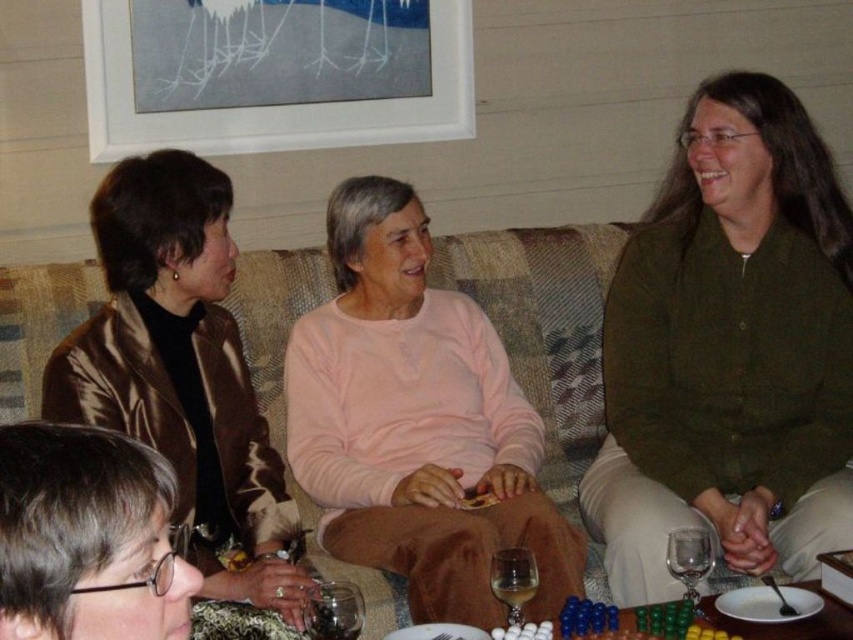
Question: Which point is farther to the camera?

Choices:
 (A) translucent glass table at lower center
 (B) green cotton shirt at right
 (C) plaid fabric couch at center
 (D) satin brown jacket at left

Answer: (C)

Question: Is pink cotton sweater at center smaller than plaid fabric couch at center?

Choices:
 (A) no
 (B) yes

Answer: (A)

Question: Which object is positioned farthest from the transparent glass at lower center?

Choices:
 (A) plaid fabric couch at center
 (B) clear glass wine glass at center

Answer: (A)

Question: From the image, what is the correct spatial relationship of green cotton shirt at right in relation to translucent glass table at lower center?

Choices:
 (A) below
 (B) above

Answer: (B)

Question: Can you confirm if pink cotton sweater at center is bigger than translucent glass table at lower center?

Choices:
 (A) yes
 (B) no

Answer: (A)

Question: Which point is closer to the camera taking this photo?

Choices:
 (A) (204, 195)
 (B) (318, 419)
 (C) (671, 547)

Answer: (C)